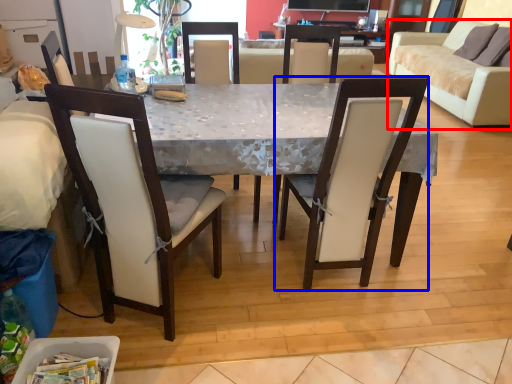
Question: Which of the following is the closest to the observer, studio couch (highlighted by a red box) or chair (highlighted by a blue box)?

Choices:
 (A) studio couch
 (B) chair

Answer: (B)